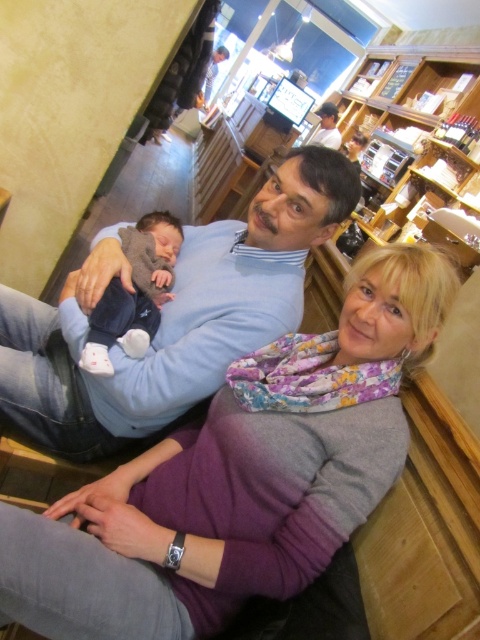
Is purple fabric scarf at center below soft blue fabric baby at center?

Correct, purple fabric scarf at center is located below soft blue fabric baby at center.

Which is more to the left, purple fabric scarf at center or soft blue fabric baby at center?

From the viewer's perspective, soft blue fabric baby at center appears more on the left side.

You are a GUI agent. You are given a task and a screenshot of the screen. Output one action in this format:
    pyautogui.click(x=<x>, y=<y>)
    Task: Click on the purple fabric scarf at center
    
    Given the screenshot: What is the action you would take?
    pyautogui.click(x=239, y=477)

This screenshot has height=640, width=480. What are the coordinates of `purple fabric scarf at center` in the screenshot? It's located at (239, 477).

Between point (287, 467) and point (26, 412), which one is positioned behind?

Positioned behind is point (26, 412).

Can you confirm if purple fabric scarf at center is bigger than matte blue sweater at center?

No, purple fabric scarf at center is not bigger than matte blue sweater at center.

Is point (228, 474) closer to camera compared to point (120, 268)?

Yes, it is.

I want to click on purple fabric scarf at center, so click(x=239, y=477).

Does matte blue sweater at center have a larger size compared to soft blue fabric baby at center?

Yes, matte blue sweater at center is bigger than soft blue fabric baby at center.

Between point (96, 276) and point (145, 253), which one is positioned in front?

Point (96, 276) is in front.

Where is `matte blue sweater at center`? Image resolution: width=480 pixels, height=640 pixels. matte blue sweater at center is located at coordinates (170, 316).